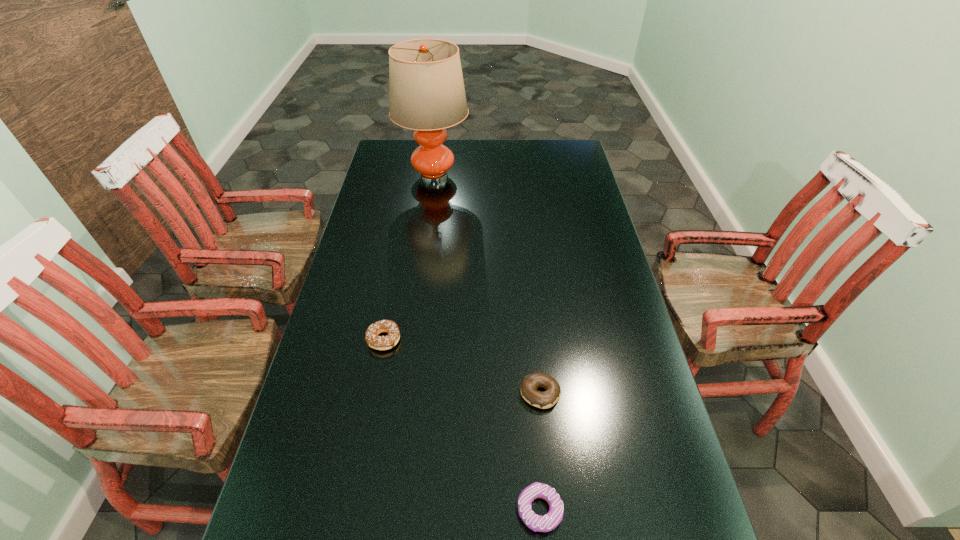
Image resolution: width=960 pixels, height=540 pixels. I want to click on free spot between the second nearest object and the nearest object, so click(540, 451).

The height and width of the screenshot is (540, 960). I want to click on vacant region between the third farthest object and the nearest object, so tap(540, 451).

Identify the location of vacant area that lies between the third nearest object and the second farthest doughnut. Image resolution: width=960 pixels, height=540 pixels. click(462, 366).

This screenshot has width=960, height=540. I want to click on free space between the second farthest doughnut and the farthest object, so click(x=488, y=285).

At what (x,y) coordinates should I click in order to perform the action: click on vacant point located between the second farthest doughnut and the farthest doughnut. Please return your answer as a coordinate pair (x, y). This screenshot has width=960, height=540. Looking at the image, I should click on pyautogui.click(x=462, y=366).

At what (x,y) coordinates should I click in order to perform the action: click on vacant point located between the tallest object and the leftmost doughnut. Please return your answer as a coordinate pair (x, y). This screenshot has height=540, width=960. Looking at the image, I should click on (409, 258).

I want to click on free space between the second nearest doughnut and the tallest object, so pyautogui.click(x=488, y=285).

Find the location of a particular element. This screenshot has height=540, width=960. vacant region between the farthest object and the nearest object is located at coordinates (487, 343).

Identify the location of vacant space in between the lamp and the nearest doughnut. (487, 343).

Locate which object is the third closest to the farthest object. Please provide its 2D coordinates. Your answer should be formatted as a tuple, i.e. [(x, y)], where the tuple contains the x and y coordinates of a point satisfying the conditions above.

[(546, 523)]